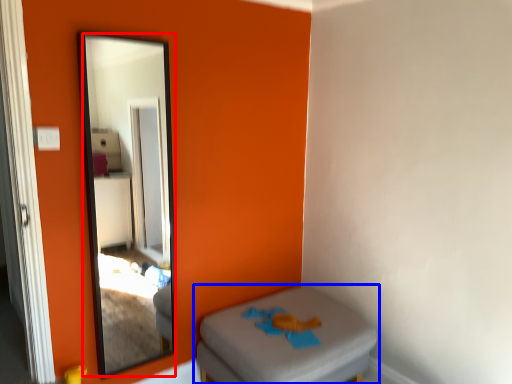
Question: Which object appears farthest to the camera in this image, mirror (highlighted by a red box) or furniture (highlighted by a blue box)?

Choices:
 (A) mirror
 (B) furniture

Answer: (B)